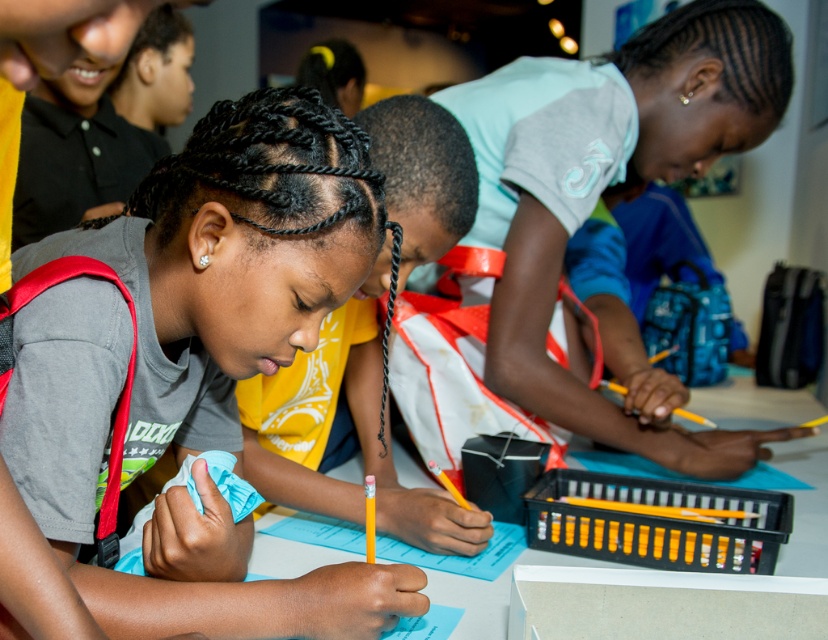
Does light blue jersey at center have a greater height compared to white plastic table at center?

Correct, light blue jersey at center is much taller as white plastic table at center.

The width and height of the screenshot is (828, 640). I want to click on light blue jersey at center, so 609,188.

This screenshot has height=640, width=828. I want to click on light blue jersey at center, so point(609,188).

Between point (92, 596) and point (797, 417), which one is positioned behind?

The point (797, 417) is more distant.

Can you confirm if matte gray shirt at center is positioned below white plastic table at center?

No, matte gray shirt at center is not below white plastic table at center.

Identify the location of matte gray shirt at center. (233, 257).

Between matte gray shirt at center and light blue jersey at center, which one has more height?

light blue jersey at center is taller.

The width and height of the screenshot is (828, 640). I want to click on matte gray shirt at center, so click(233, 257).

I want to click on matte gray shirt at center, so click(233, 257).

This screenshot has width=828, height=640. What are the coordinates of `matte gray shirt at center` in the screenshot? It's located at (233, 257).